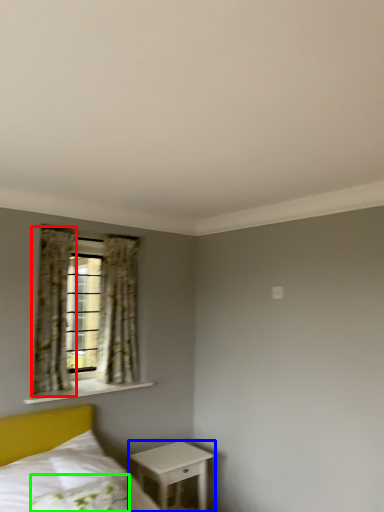
Question: Based on their relative distances, which object is farther from curtain (highlighted by a red box)? Choose from nightstand (highlighted by a blue box) and pillow (highlighted by a green box).

Choices:
 (A) nightstand
 (B) pillow

Answer: (B)